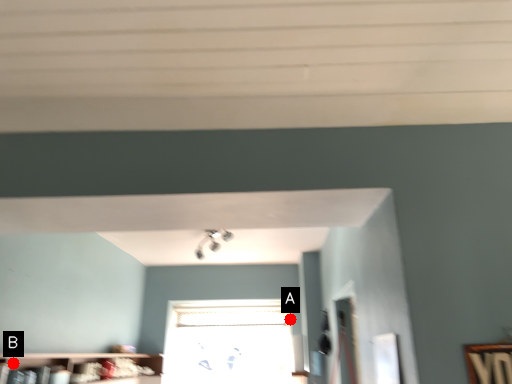
Question: Two points are circled on the image, labeled by A and B beside each circle. Which point is further to the camera?

Choices:
 (A) A is further
 (B) B is further

Answer: (A)